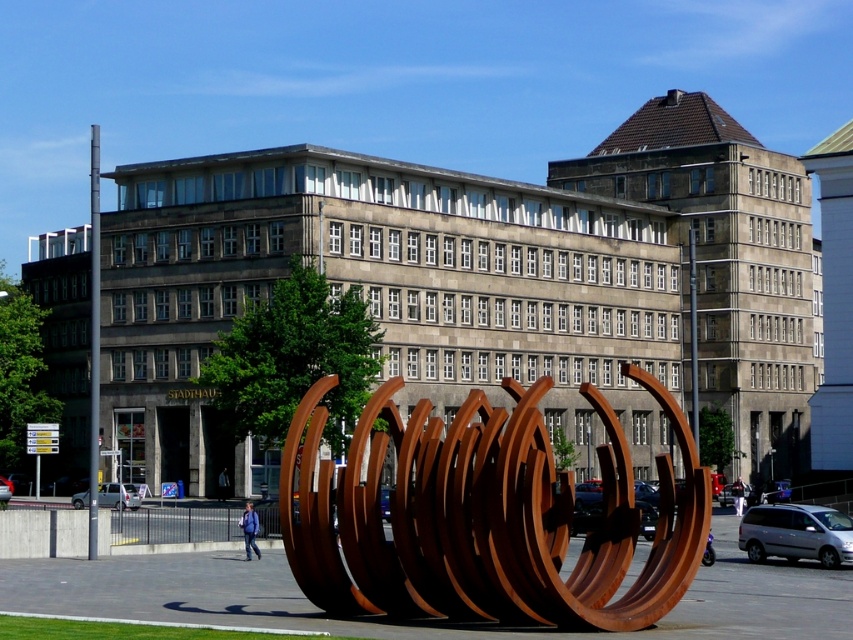
Question: Which point is closer to the camera taking this photo?

Choices:
 (A) (498, 620)
 (B) (244, 506)
 (C) (732, 483)

Answer: (A)

Question: Is purple fabric backpack at center thinner than light beige fabric jacket at lower right?

Choices:
 (A) no
 (B) yes

Answer: (B)

Question: Can you confirm if rusty metal sculpture at center is thinner than light beige fabric jacket at lower right?

Choices:
 (A) no
 (B) yes

Answer: (A)

Question: Does rusty metal sculpture at center have a greater width compared to purple fabric backpack at center?

Choices:
 (A) yes
 (B) no

Answer: (A)

Question: Which point appears farthest from the camera in this image?

Choices:
 (A) (247, 534)
 (B) (577, 560)

Answer: (B)

Question: Which point is farther from the camera taking this photo?

Choices:
 (A) (222, 483)
 (B) (248, 512)
 (C) (737, 506)
 (D) (387, 417)

Answer: (A)